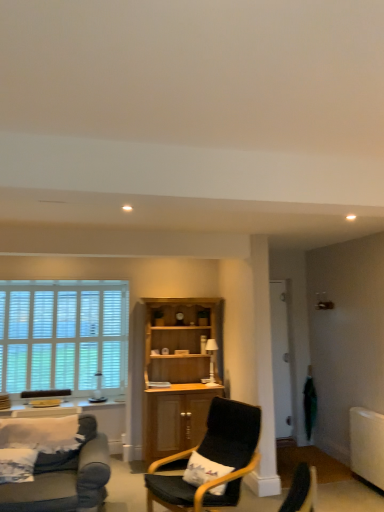
Question: Can you confirm if black fabric chair at center is thinner than white glossy lamp at center?

Choices:
 (A) yes
 (B) no

Answer: (B)

Question: Can you confirm if black fabric chair at center is taller than white glossy lamp at center?

Choices:
 (A) no
 (B) yes

Answer: (B)

Question: Does black fabric chair at center have a lesser height compared to white glossy lamp at center?

Choices:
 (A) no
 (B) yes

Answer: (A)

Question: Does black fabric chair at center turn towards white glossy lamp at center?

Choices:
 (A) yes
 (B) no

Answer: (B)

Question: Would you say white glossy lamp at center is part of black fabric chair at center's contents?

Choices:
 (A) yes
 (B) no

Answer: (B)

Question: Is black fabric chair at center far from white glossy lamp at center?

Choices:
 (A) no
 (B) yes

Answer: (B)

Question: From the image's perspective, is white wooden blinds at left beneath matte black armchair at lower left?

Choices:
 (A) no
 (B) yes

Answer: (A)

Question: Does white wooden blinds at left have a lesser height compared to matte black armchair at lower left?

Choices:
 (A) no
 (B) yes

Answer: (A)

Question: Is white wooden blinds at left smaller than matte black armchair at lower left?

Choices:
 (A) no
 (B) yes

Answer: (A)

Question: Can you confirm if white wooden blinds at left is wider than matte black armchair at lower left?

Choices:
 (A) yes
 (B) no

Answer: (B)

Question: From a real-world perspective, is white wooden blinds at left physically below matte black armchair at lower left?

Choices:
 (A) no
 (B) yes

Answer: (A)

Question: Could you tell me if white wooden blinds at left is facing matte black armchair at lower left?

Choices:
 (A) no
 (B) yes

Answer: (B)

Question: Is transparent glass door at center-right taller than matte black armchair at lower left?

Choices:
 (A) no
 (B) yes

Answer: (B)